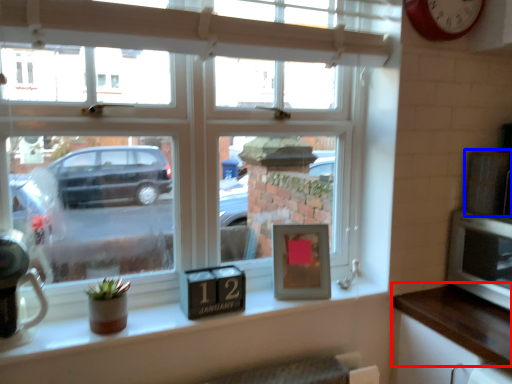
Question: Which point is closer to the camera, counter top (highlighted by a red box) or appliance (highlighted by a blue box)?

Choices:
 (A) counter top
 (B) appliance

Answer: (A)